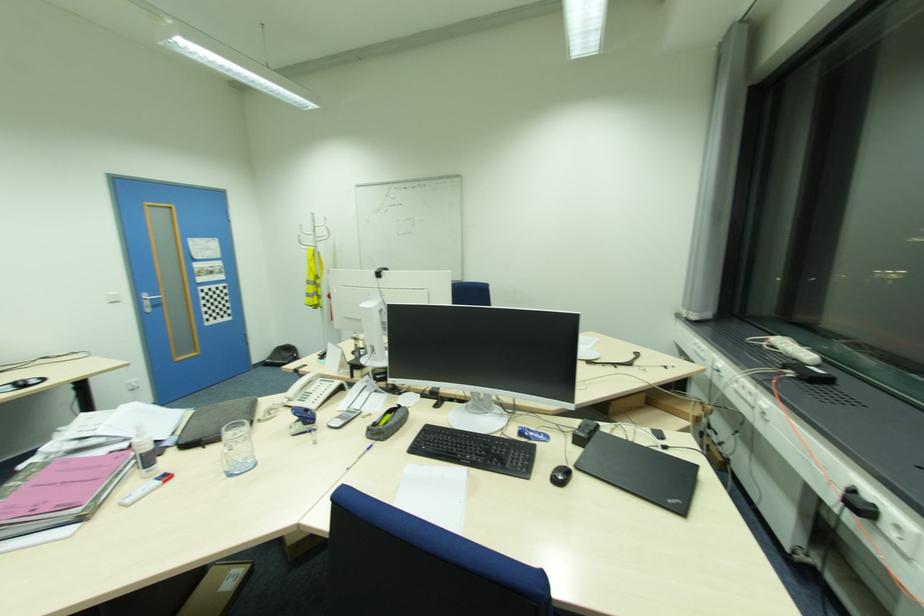
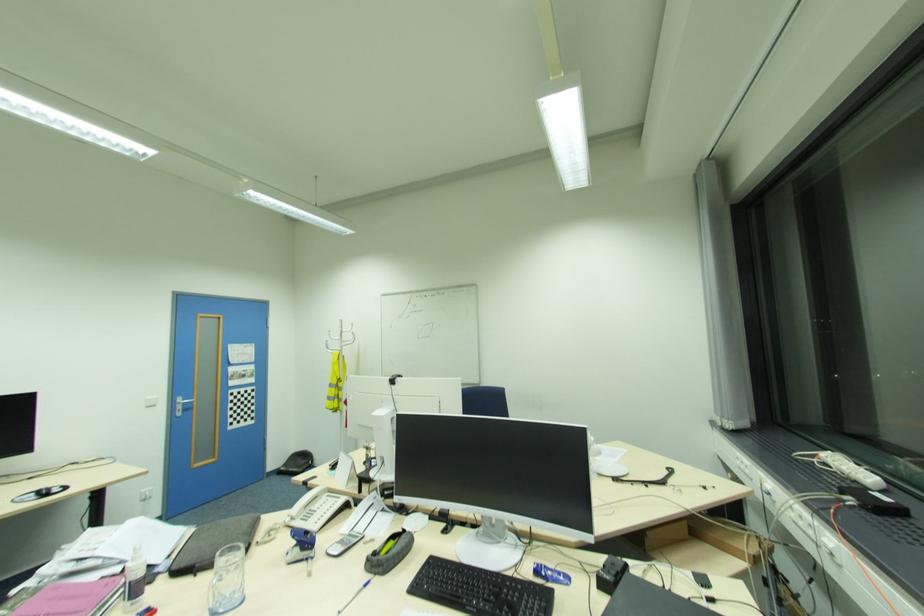
The point at (312, 431) is marked in the first image. Where is the corresponding point in the second image?

(310, 559)